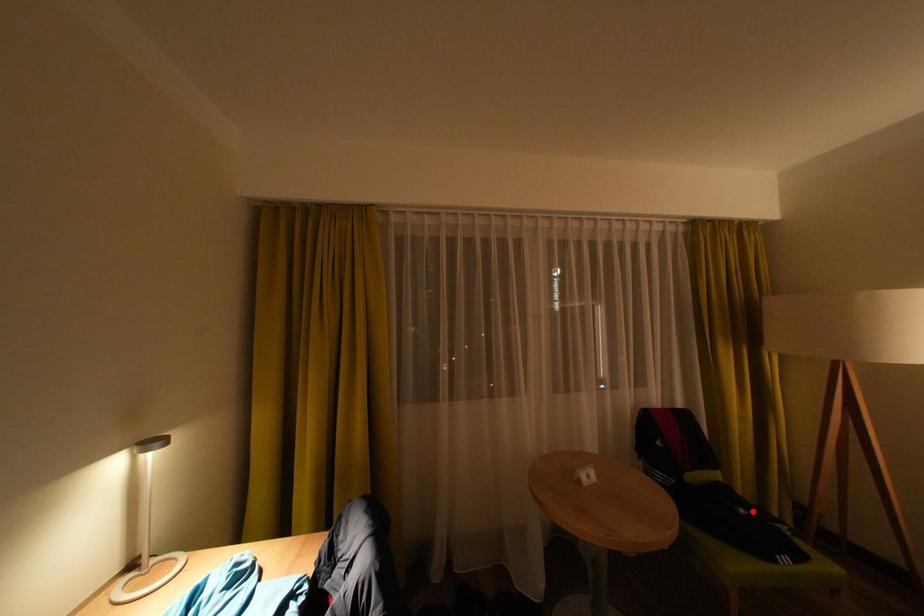
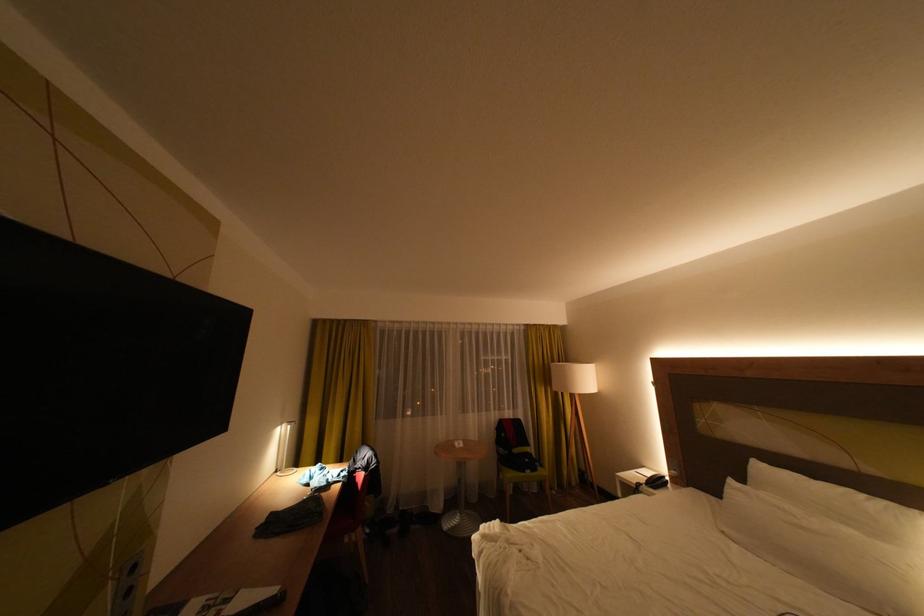
The point at the highlighted location is marked in the first image. Where is the corresponding point in the second image?

(538, 460)